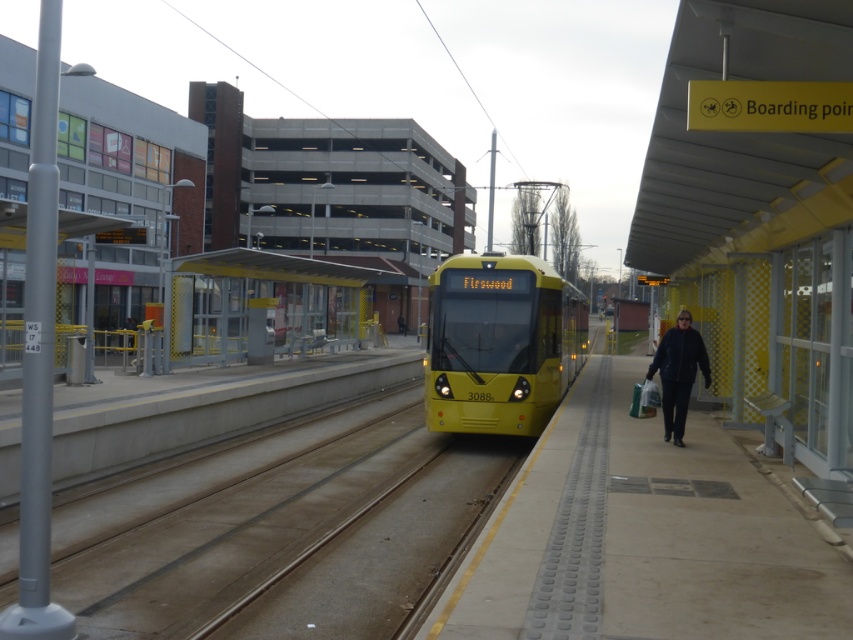
Question: Can you confirm if yellow metallic bus stop at center is positioned below dark blue leather jacket at center?

Choices:
 (A) no
 (B) yes

Answer: (A)

Question: Among these points, which one is nearest to the camera?

Choices:
 (A) (704, 566)
 (B) (665, 410)
 (C) (432, 349)
 (D) (231, 260)

Answer: (A)

Question: Which of the following is the closest to the observer?

Choices:
 (A) dark blue leather jacket at center
 (B) smooth concrete platform at center
 (C) yellow metallic bus stop at center
 (D) yellow matte train at center

Answer: (B)

Question: In this image, where is yellow matte train at center located relative to dark blue leather jacket at center?

Choices:
 (A) below
 (B) above

Answer: (B)

Question: Is yellow metallic bus stop at center to the left of dark blue leather jacket at center from the viewer's perspective?

Choices:
 (A) no
 (B) yes

Answer: (B)

Question: Which point is closer to the camera taking this photo?

Choices:
 (A) [x=695, y=532]
 (B) [x=315, y=260]
 (C) [x=653, y=362]
 (D) [x=451, y=404]

Answer: (A)